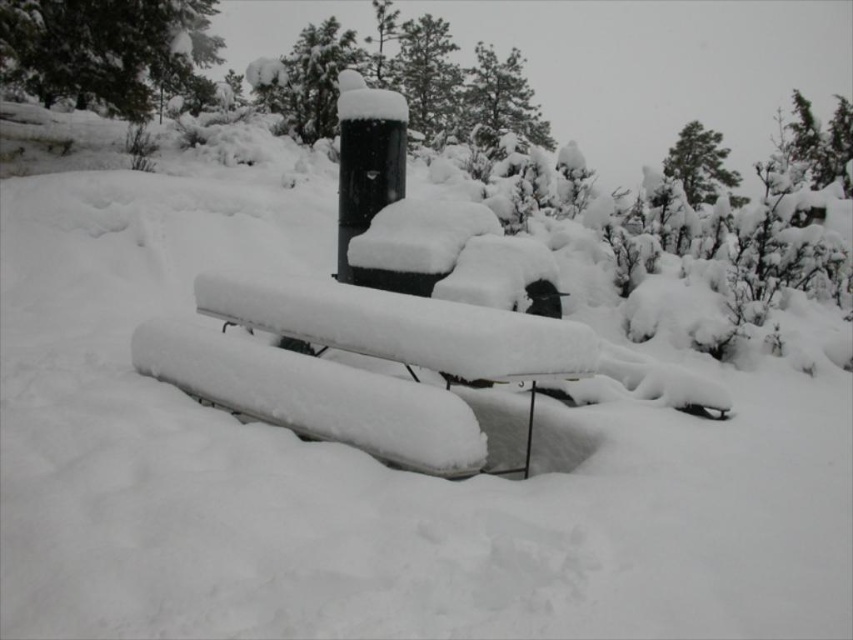
Question: Which point is farther to the camera?

Choices:
 (A) (380, 1)
 (B) (489, 100)
 (C) (213, 44)

Answer: (C)

Question: Does green textured pine tree at upper center have a lesser width compared to green textured tree at upper right?

Choices:
 (A) yes
 (B) no

Answer: (A)

Question: Can you confirm if green textured pine at upper left is bigger than green textured pine tree at upper center?

Choices:
 (A) no
 (B) yes

Answer: (A)

Question: Is green textured pine at upper left below green textured tree at upper right?

Choices:
 (A) yes
 (B) no

Answer: (B)

Question: Which point is closer to the camera?

Choices:
 (A) green textured tree at upper right
 (B) white snow-covered bench at center
 (C) snow-covered pine tree at upper center
 (D) green textured pine at upper left

Answer: (B)

Question: Which point is closer to the camera?

Choices:
 (A) click(149, 29)
 (B) click(517, 92)
 (C) click(199, 333)

Answer: (C)